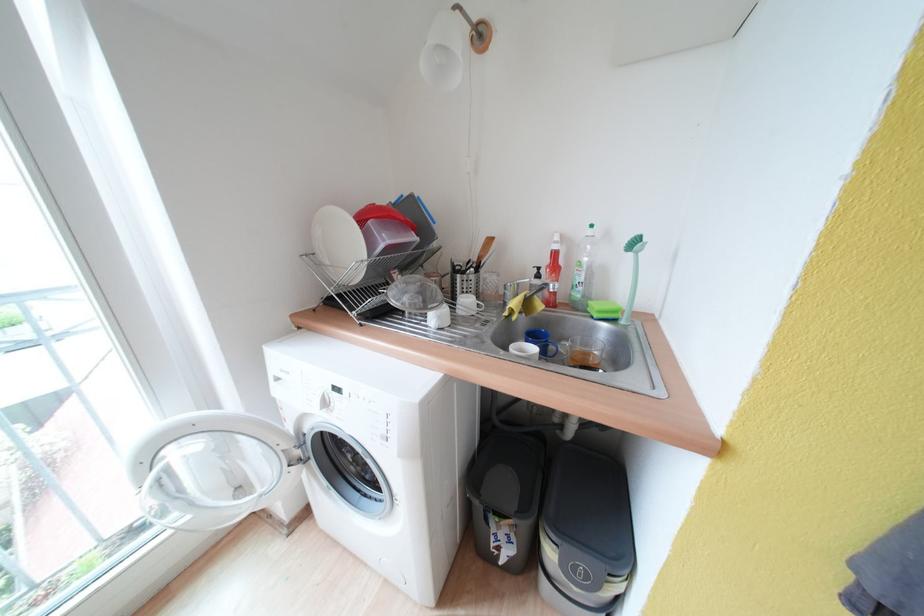
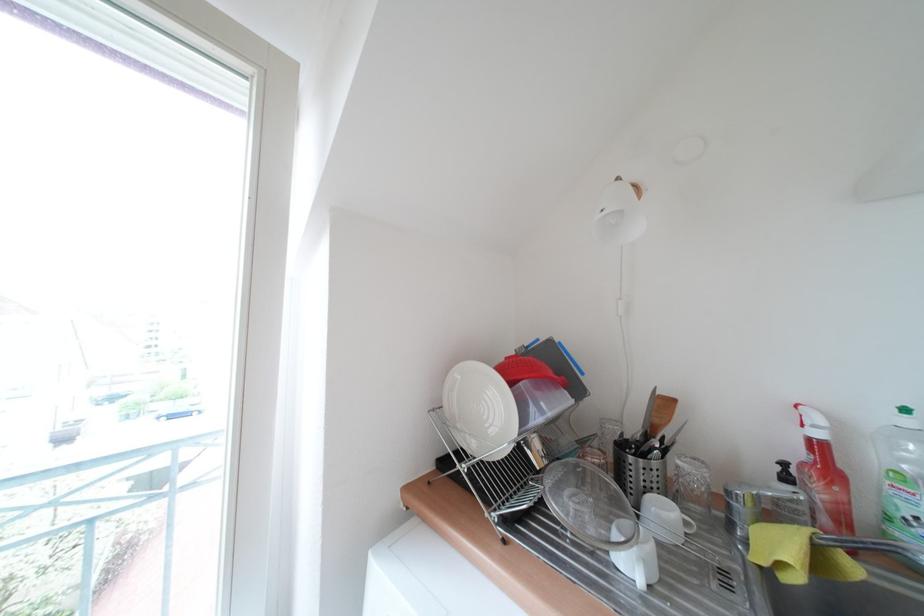
Where in the second image is the point corresponding to the point at 598,230 from the first image?

(912, 413)